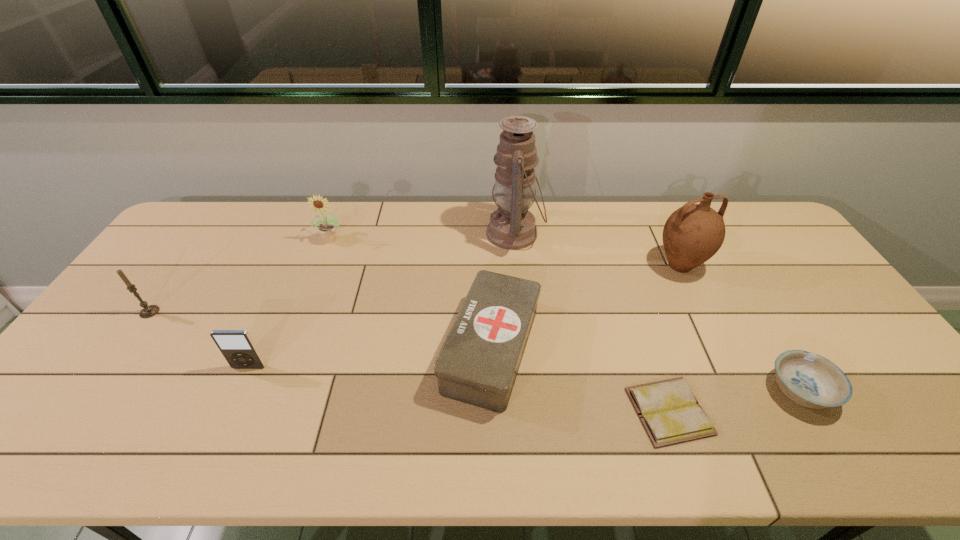
Where is `object that is the nearest to the shortest object`? The width and height of the screenshot is (960, 540). object that is the nearest to the shortest object is located at coordinates (811, 380).

Select which object is the seventh closest to the iPod. Please provide its 2D coordinates. Your answer should be formatted as a tuple, i.e. [(x, y)], where the tuple contains the x and y coordinates of a point satisfying the conditions above.

[(811, 380)]